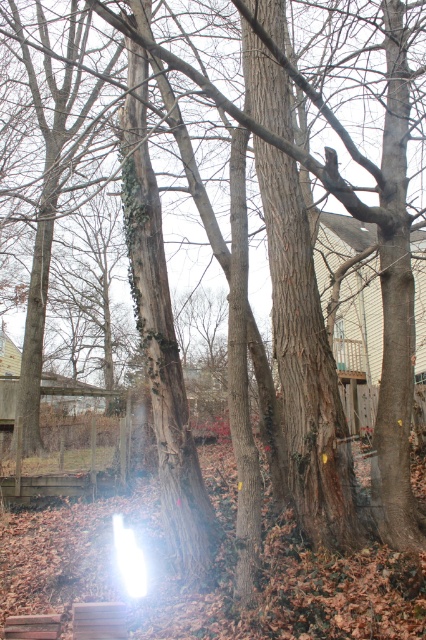
Can you confirm if brown wooden bench at lower left is bigger than brown wooden plank at lower left?

Yes, brown wooden bench at lower left is bigger than brown wooden plank at lower left.

Can you confirm if brown wooden bench at lower left is positioned to the right of brown wooden plank at lower left?

Indeed, brown wooden bench at lower left is positioned on the right side of brown wooden plank at lower left.

Image resolution: width=426 pixels, height=640 pixels. Identify the location of brown wooden bench at lower left. (98, 620).

Where is `brown wooden bench at lower left`? This screenshot has height=640, width=426. brown wooden bench at lower left is located at coordinates (98, 620).